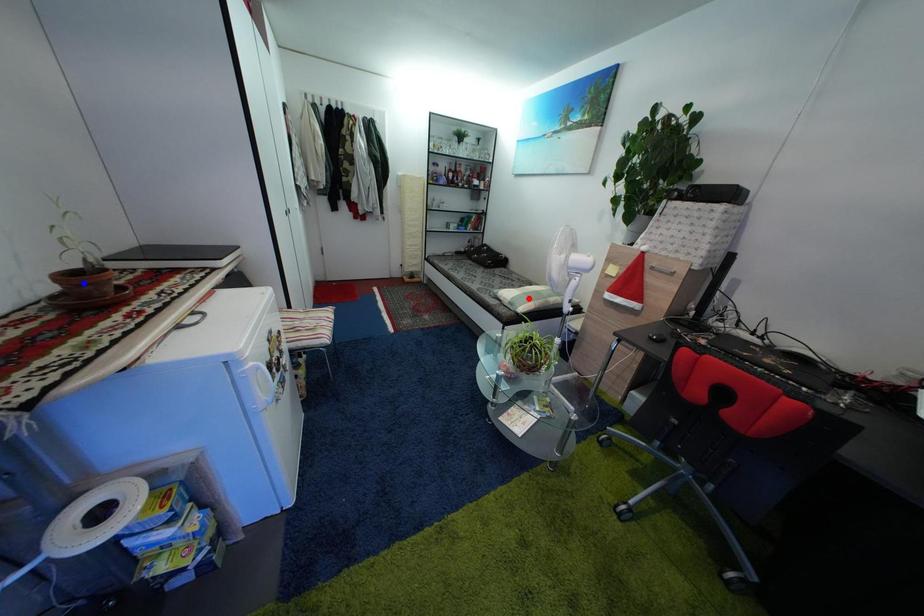
Question: In the image, two points are highlighted. Which point is nearer to the camera? Reply with the corresponding letter.

Choices:
 (A) blue point
 (B) red point

Answer: (A)